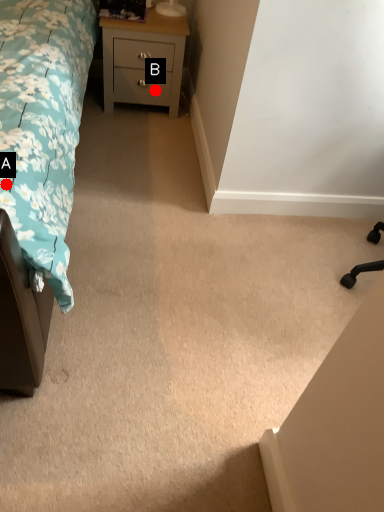
Question: Two points are circled on the image, labeled by A and B beside each circle. Which point is closer to the camera?

Choices:
 (A) A is closer
 (B) B is closer

Answer: (A)